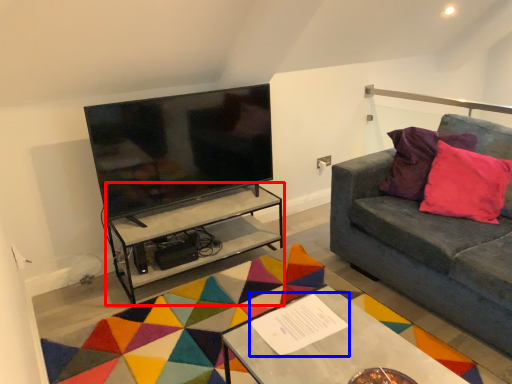
Question: Which object is closer to the camera taking this photo, table (highlighted by a red box) or square (highlighted by a blue box)?

Choices:
 (A) table
 (B) square

Answer: (B)